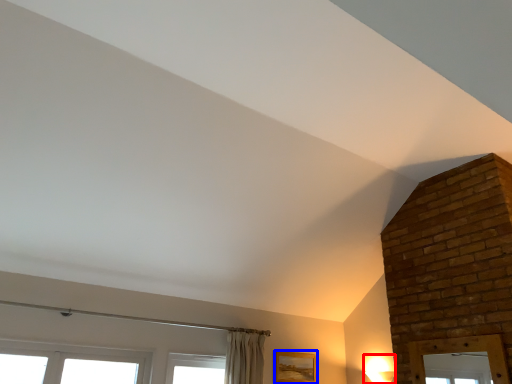
Question: Which point is further to the camera, light fixture (highlighted by a red box) or picture frame (highlighted by a blue box)?

Choices:
 (A) light fixture
 (B) picture frame

Answer: (B)